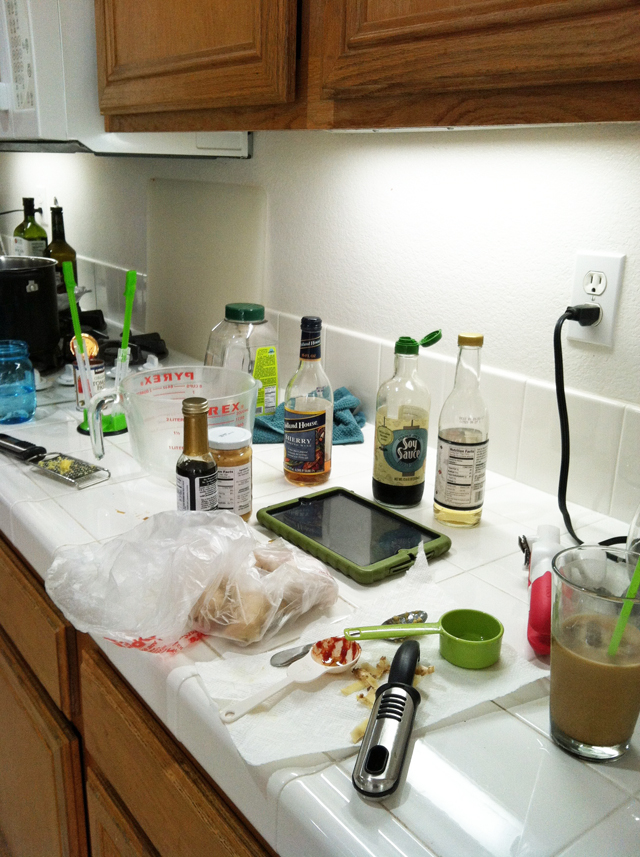
What are the coordinates of `white countertop` in the screenshot? It's located at (488, 819).